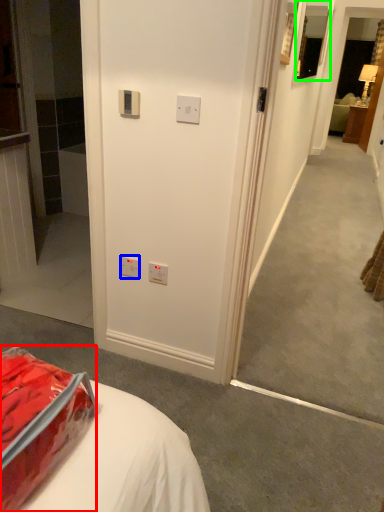
Question: Which is farther away from package (highlighted by a red box)? electric outlet (highlighted by a blue box) or picture frame (highlighted by a green box)?

Choices:
 (A) electric outlet
 (B) picture frame

Answer: (B)